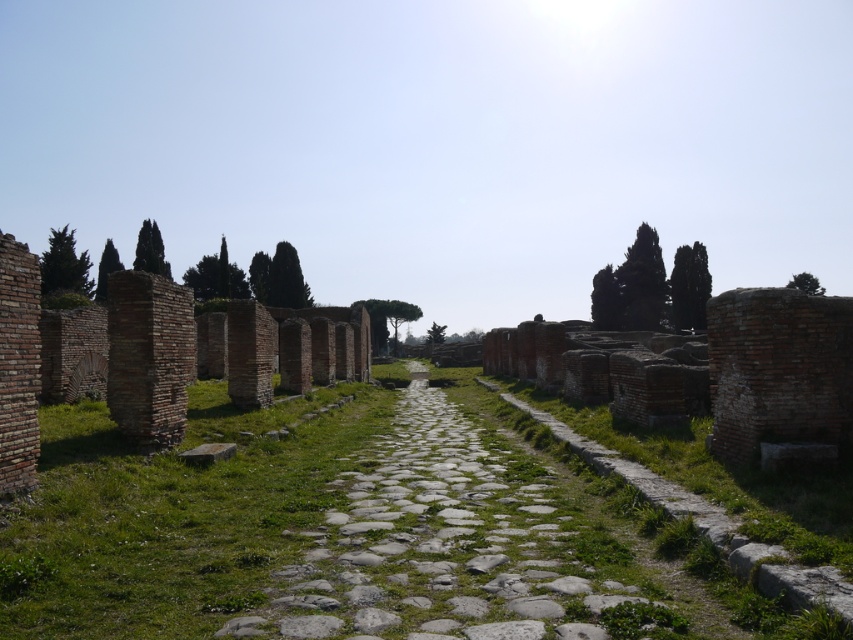
Question: Considering the real-world distances, which object is closest to the green textured cypress tree at upper left?

Choices:
 (A) gray stone at center
 (B) gray stone path at center
 (C) green leafy cypress at upper left
 (D) brick wall at center

Answer: (D)

Question: Which object appears closest to the camera in this image?

Choices:
 (A) gray stone at center
 (B) green grass at center

Answer: (B)

Question: Does brick wall at center appear on the right side of gray stone at center?

Choices:
 (A) yes
 (B) no

Answer: (B)

Question: Which point is farther to the camera?

Choices:
 (A) gray stone path at center
 (B) green grass at center

Answer: (A)

Question: Does gray stone path at center appear under green textured cypress tree at upper left?

Choices:
 (A) yes
 (B) no

Answer: (A)

Question: Is green grass at center to the left of green leafy cypress at upper left from the viewer's perspective?

Choices:
 (A) no
 (B) yes

Answer: (A)